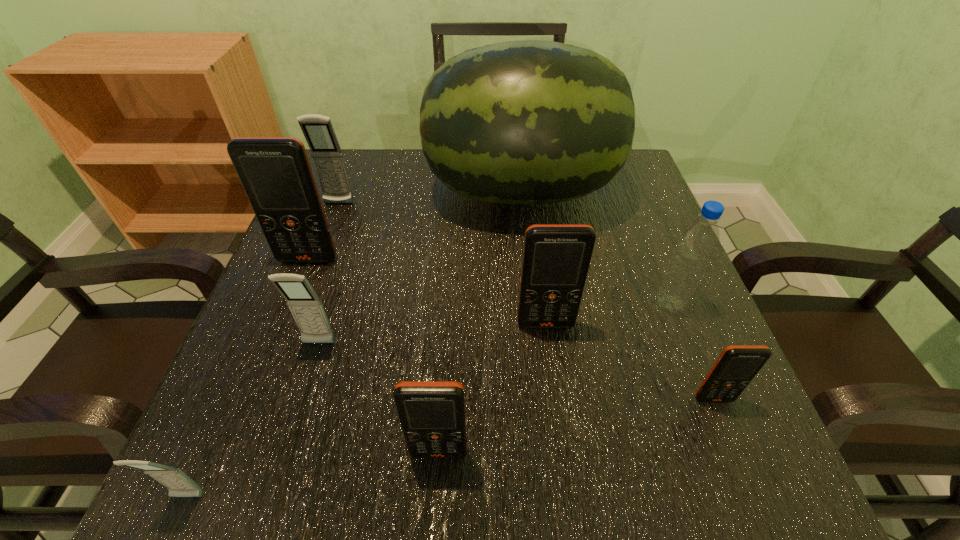
Image resolution: width=960 pixels, height=540 pixels. Find the location of `free space located 0.200m on the screen of the third farthest cellular telephone`. free space located 0.200m on the screen of the third farthest cellular telephone is located at coordinates click(561, 443).

This screenshot has height=540, width=960. What are the coordinates of `vacant position located on the back of the fourth farthest object` in the screenshot? It's located at (636, 218).

Locate an element on the screen. vacant space located on the front-facing side of the second farthest gray cellular telephone is located at coordinates (271, 502).

Identify the location of vacant space located on the screen of the seventh farthest object. This screenshot has width=960, height=540. (745, 478).

Identify the location of watermelon that is at the far edge. (526, 122).

Identify the location of cellular telephone at the far edge. The width and height of the screenshot is (960, 540). tap(318, 131).

At what (x,y) coordinates should I click in order to perform the action: click on watermelon at the right edge. Please return your answer as a coordinate pair (x, y). The image size is (960, 540). Looking at the image, I should click on (526, 122).

Where is `water bottle situated at the right edge`? water bottle situated at the right edge is located at coordinates (698, 241).

The width and height of the screenshot is (960, 540). Identify the location of cellular telephone positioned at the right edge. (736, 366).

Find the location of `object located at the far left corner`. object located at the far left corner is located at coordinates (318, 131).